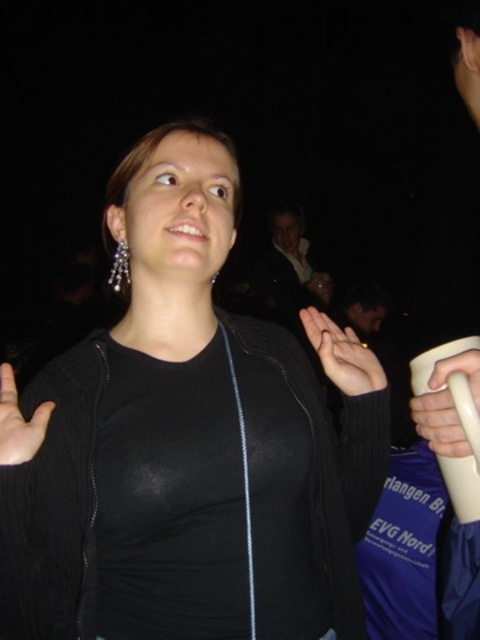
Does black matte jacket at center have a larger size compared to matte black hand at center?

Indeed, black matte jacket at center has a larger size compared to matte black hand at center.

Between black matte jacket at center and matte black hand at center, which one has less height?

matte black hand at center

At what (x,y) coordinates should I click in order to perform the action: click on black matte jacket at center. Please return your answer as a coordinate pair (x, y). The image size is (480, 640). Looking at the image, I should click on (187, 445).

What do you see at coordinates (187, 445) in the screenshot? I see `black matte jacket at center` at bounding box center [187, 445].

Who is shorter, black matte jacket at center or smooth skin palm at lower left?

smooth skin palm at lower left

Does point (115, 326) come closer to viewer compared to point (41, 416)?

That is False.

Where is `black matte jacket at center`? Image resolution: width=480 pixels, height=640 pixels. black matte jacket at center is located at coordinates (187, 445).

Which of these two, black matte jacket at center or white matte cup at right, stands taller?

Standing taller between the two is black matte jacket at center.

You are a GUI agent. You are given a task and a screenshot of the screen. Output one action in this format:
    pyautogui.click(x=<x>, y=<y>)
    Task: Click on the black matte jacket at center
    This screenshot has width=480, height=640.
    Given the screenshot: What is the action you would take?
    pyautogui.click(x=187, y=445)

The width and height of the screenshot is (480, 640). Describe the element at coordinates (187, 445) in the screenshot. I see `black matte jacket at center` at that location.

Identify the location of black matte jacket at center. The height and width of the screenshot is (640, 480). (187, 445).